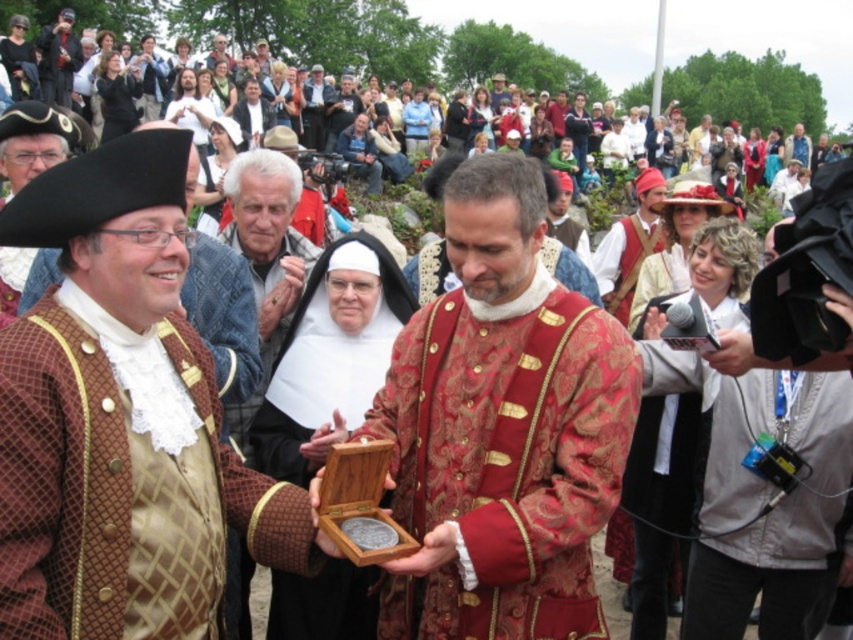
Based on the scene described, which object is positioned to the right of the other between the shiny gold brocade coat at center and the wooden box at center?

The shiny gold brocade coat at center is to the right of the wooden box at center.

You are an event photographer at the historical reenactment. You need to capture a closeup of the shiny gold brocade coat at center. Based on its position, which direction should you move to get a better shot?

The shiny gold brocade coat at center is located at point (502, 428), so you should move to the right to get a better shot.